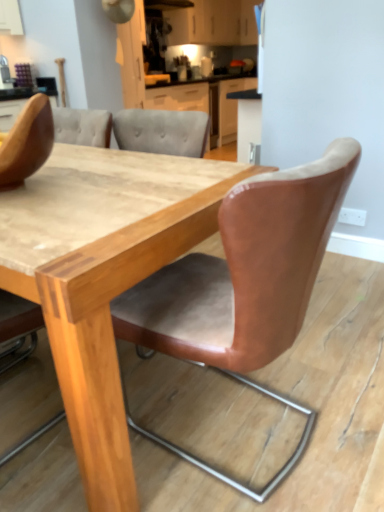
Find the location of a particular element. vacant space underneath leather-like tan chair at center, positioned as the second chair in left-to-right order (from a real-world perspective) is located at coordinates (265, 439).